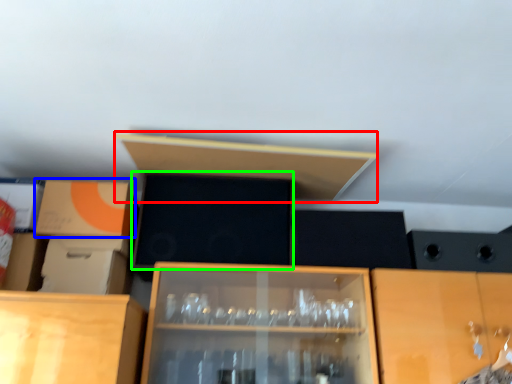
Question: Considering the real-world distances, which object is farthest from shelf (highlighted by a red box)? cardboard box (highlighted by a blue box) or box (highlighted by a green box)?

Choices:
 (A) cardboard box
 (B) box

Answer: (A)